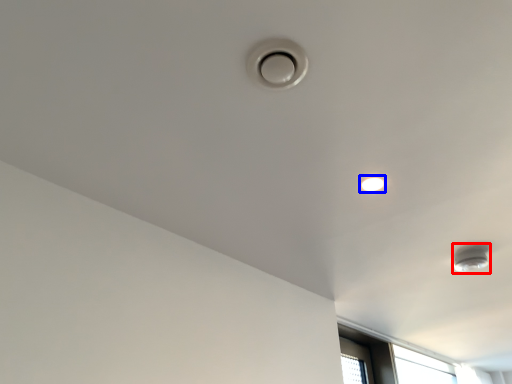
Question: Which object is further to the camera taking this photo, lamp (highlighted by a red box) or droplight (highlighted by a blue box)?

Choices:
 (A) lamp
 (B) droplight

Answer: (A)